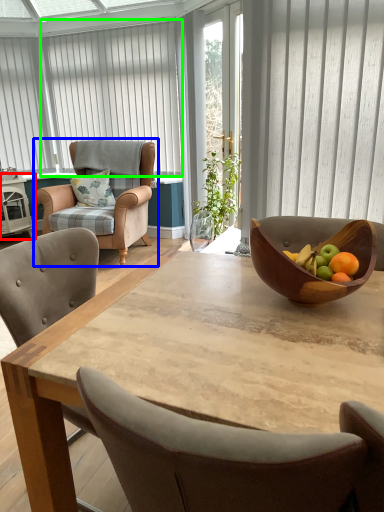
Question: Which object is the farthest from side table (highlighted by a red box)? Choose among these: chair (highlighted by a blue box) or curtain (highlighted by a green box).

Choices:
 (A) chair
 (B) curtain

Answer: (B)